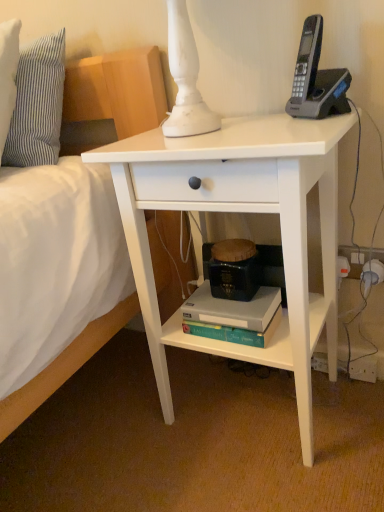
Question: Is the position of teal matte paperback book at lower center more distant than that of striped fabric pillow at upper left?

Choices:
 (A) no
 (B) yes

Answer: (A)

Question: Is teal matte paperback book at lower center in contact with striped fabric pillow at upper left?

Choices:
 (A) yes
 (B) no

Answer: (B)

Question: From a real-world perspective, does teal matte paperback book at lower center sit lower than striped fabric pillow at upper left?

Choices:
 (A) yes
 (B) no

Answer: (A)

Question: Does teal matte paperback book at lower center appear on the right side of striped fabric pillow at upper left?

Choices:
 (A) yes
 (B) no

Answer: (A)

Question: Is teal matte paperback book at lower center not inside striped fabric pillow at upper left?

Choices:
 (A) no
 (B) yes

Answer: (B)

Question: From the image's perspective, is teal matte paperback book at lower center located beneath striped fabric pillow at upper left?

Choices:
 (A) no
 (B) yes

Answer: (B)

Question: Is teal matte paperback book at lower center thinner than black plastic phone at upper right?

Choices:
 (A) no
 (B) yes

Answer: (A)

Question: Is teal matte paperback book at lower center bigger than black plastic phone at upper right?

Choices:
 (A) yes
 (B) no

Answer: (A)

Question: From a real-world perspective, is teal matte paperback book at lower center on black plastic phone at upper right?

Choices:
 (A) no
 (B) yes

Answer: (A)

Question: From the image's perspective, is teal matte paperback book at lower center on top of black plastic phone at upper right?

Choices:
 (A) no
 (B) yes

Answer: (A)

Question: Can you confirm if teal matte paperback book at lower center is positioned to the right of black plastic phone at upper right?

Choices:
 (A) yes
 (B) no

Answer: (B)

Question: From a real-world perspective, is teal matte paperback book at lower center below black plastic phone at upper right?

Choices:
 (A) no
 (B) yes

Answer: (B)

Question: Is black plastic phone at upper right not near striped fabric pillow at upper left?

Choices:
 (A) yes
 (B) no

Answer: (B)